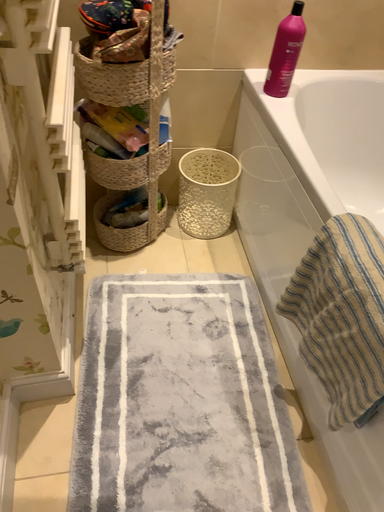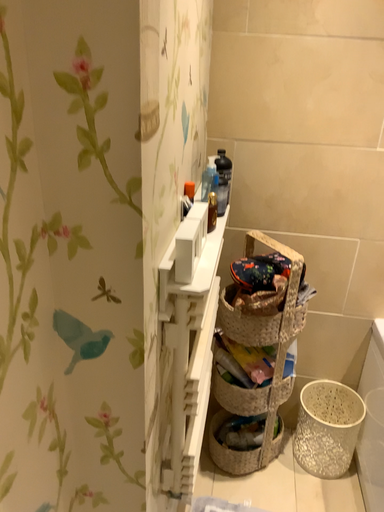
Question: Which way did the camera rotate in the video?

Choices:
 (A) rotated upward
 (B) rotated downward

Answer: (A)